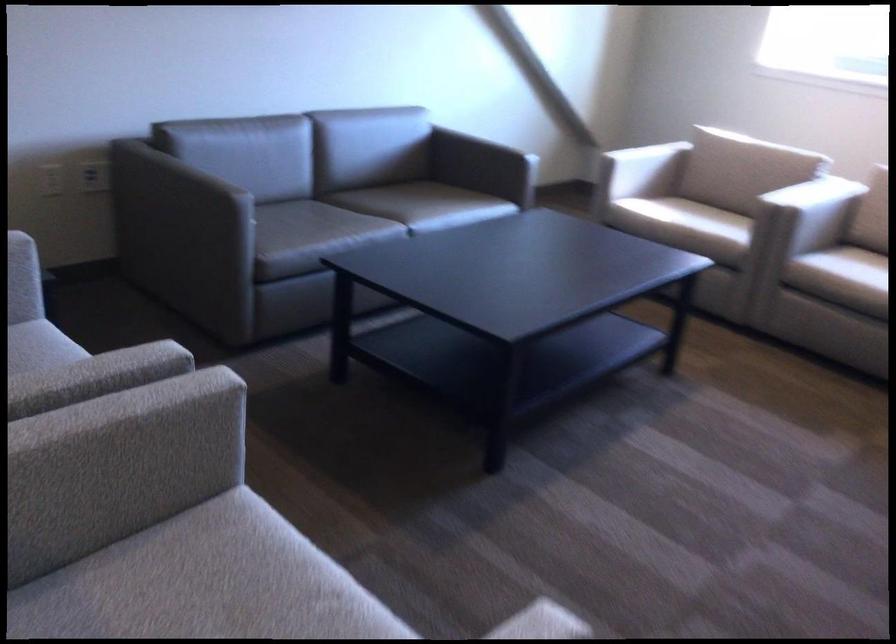
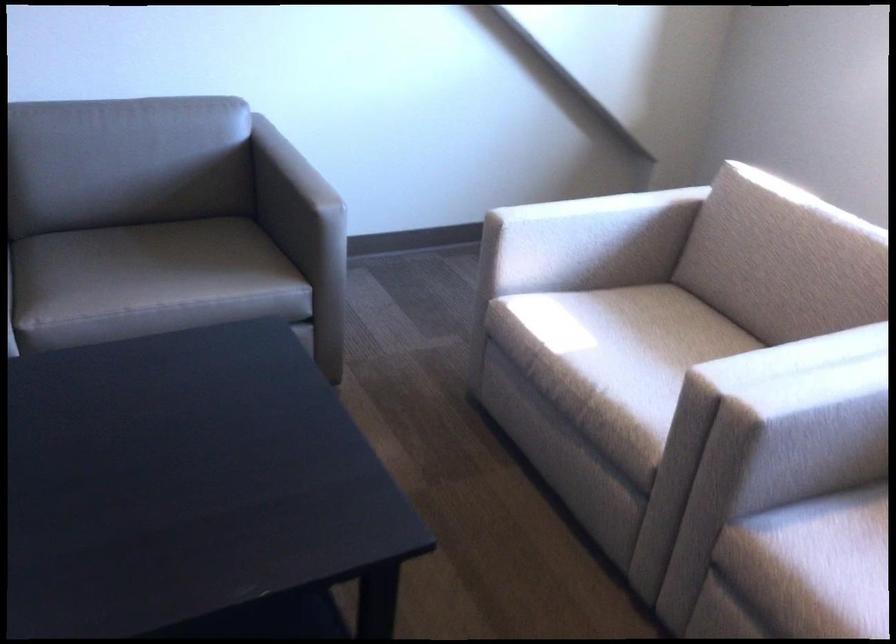
In a continuous first-person perspective shot, in which direction is the camera moving?

The cameraman walked toward right, forward.